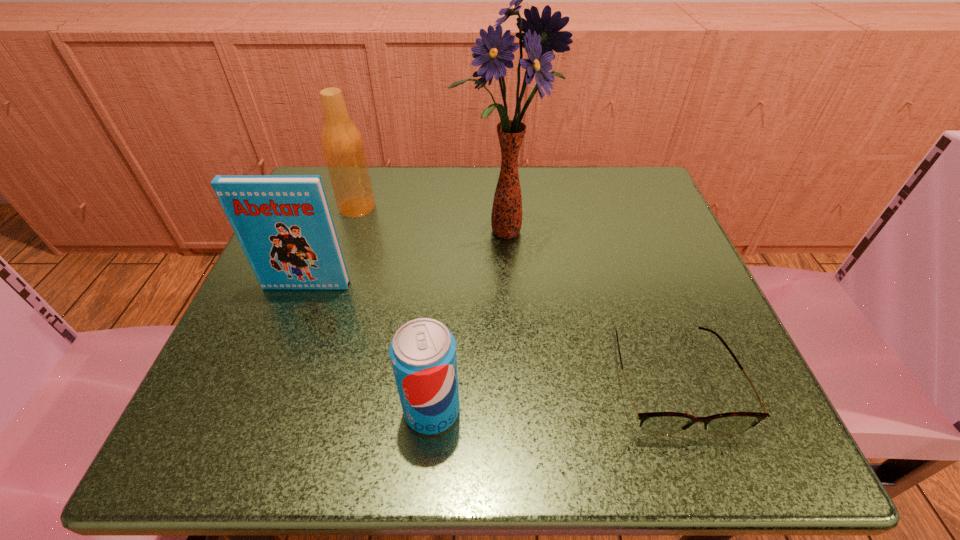
Image resolution: width=960 pixels, height=540 pixels. Find the location of `flower arrangement present at the far edge`. flower arrangement present at the far edge is located at coordinates (541, 36).

At what (x,y) coordinates should I click in order to perform the action: click on beer bottle located at the far edge. Please return your answer as a coordinate pair (x, y). This screenshot has width=960, height=540. Looking at the image, I should click on 342,144.

Locate an element on the screen. The width and height of the screenshot is (960, 540). soda can that is at the near edge is located at coordinates (423, 351).

Identify the location of spectacles that is at the near edge. (652, 423).

Find the location of a particular element. beer bottle that is positioned at the left edge is located at coordinates (342, 144).

The image size is (960, 540). I want to click on book that is positioned at the left edge, so click(283, 223).

Locate an element on the screen. The height and width of the screenshot is (540, 960). object at the right edge is located at coordinates (652, 423).

Identify the location of object that is positioned at the far left corner. This screenshot has width=960, height=540. (342, 144).

This screenshot has height=540, width=960. I want to click on object that is positioned at the near right corner, so click(652, 423).

Find the location of a particular element. Image resolution: width=960 pixels, height=540 pixels. free region at the far edge of the desktop is located at coordinates (463, 166).